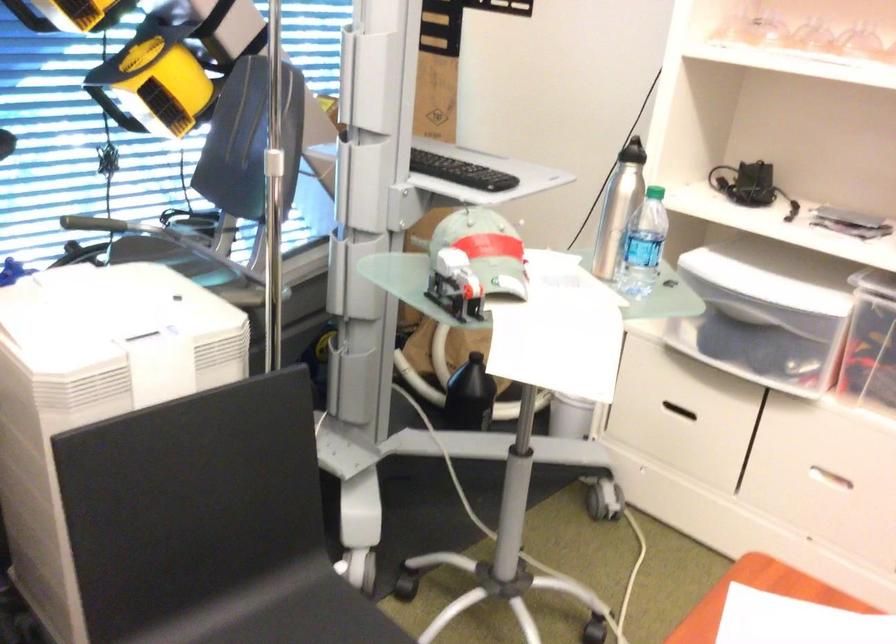
Find the location of a particular element. The width and height of the screenshot is (896, 644). red and grey cap is located at coordinates (484, 249).